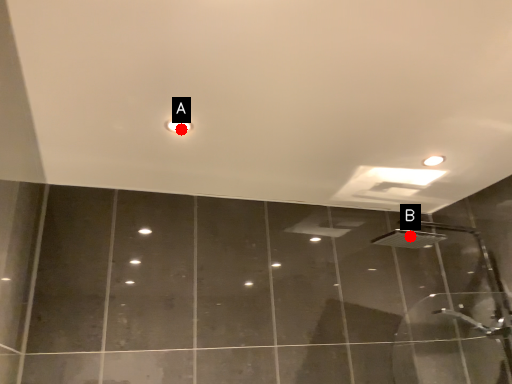
Question: Two points are circled on the image, labeled by A and B beside each circle. Among these points, which one is nearest to the camera?

Choices:
 (A) A is closer
 (B) B is closer

Answer: (A)